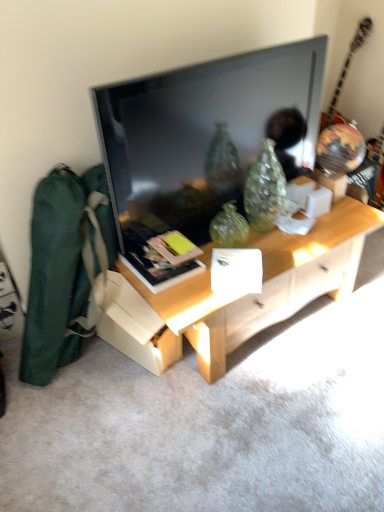
Question: From the image's perspective, is light wood desk at center located beneath flat screen tv at center?

Choices:
 (A) no
 (B) yes

Answer: (B)

Question: Are light wood desk at center and flat screen tv at center far apart?

Choices:
 (A) yes
 (B) no

Answer: (B)

Question: Can you confirm if light wood desk at center is smaller than flat screen tv at center?

Choices:
 (A) yes
 (B) no

Answer: (B)

Question: Is light wood desk at center positioned with its back to flat screen tv at center?

Choices:
 (A) no
 (B) yes

Answer: (A)

Question: Is light wood desk at center facing towards flat screen tv at center?

Choices:
 (A) yes
 (B) no

Answer: (B)

Question: Does light wood desk at center have a greater width compared to flat screen tv at center?

Choices:
 (A) no
 (B) yes

Answer: (B)

Question: Would you say matte black book at center is part of glossy wood guitar at upper right's contents?

Choices:
 (A) yes
 (B) no

Answer: (B)

Question: Considering the relative positions of glossy wood guitar at upper right and matte black book at center in the image provided, is glossy wood guitar at upper right behind matte black book at center?

Choices:
 (A) no
 (B) yes

Answer: (B)

Question: From the image's perspective, is glossy wood guitar at upper right above matte black book at center?

Choices:
 (A) no
 (B) yes

Answer: (B)

Question: From the image's perspective, is glossy wood guitar at upper right below matte black book at center?

Choices:
 (A) yes
 (B) no

Answer: (B)

Question: From a real-world perspective, is glossy wood guitar at upper right positioned under matte black book at center based on gravity?

Choices:
 (A) yes
 (B) no

Answer: (B)

Question: Is glossy wood guitar at upper right positioned in front of matte black book at center?

Choices:
 (A) no
 (B) yes

Answer: (A)

Question: Is flat screen tv at center not inside light wood desk at center?

Choices:
 (A) no
 (B) yes

Answer: (B)